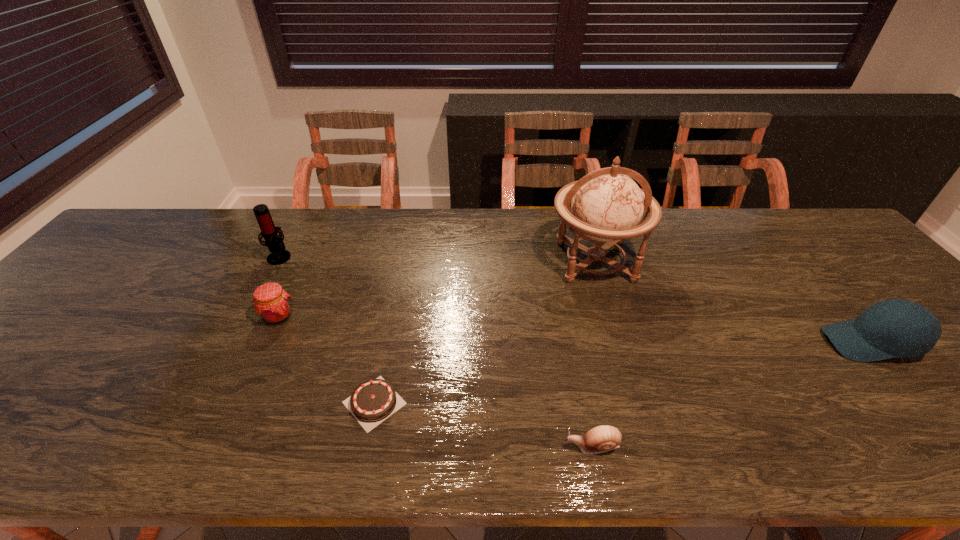
Identify the location of free space that is in between the shortest object and the leftmost object. This screenshot has height=540, width=960. tap(327, 329).

Where is `free spot between the escargot and the third object from left to right`? This screenshot has width=960, height=540. free spot between the escargot and the third object from left to right is located at coordinates (484, 424).

Identify the location of vacant area that lies between the second shortest object and the chocolate cake. This screenshot has height=540, width=960. coord(484,424).

Locate an element on the screen. The height and width of the screenshot is (540, 960). free space between the microphone and the fifth tallest object is located at coordinates (436, 351).

At what (x,y) coordinates should I click in order to perform the action: click on free space that is in between the rightmost object and the microphone. Please return your answer as a coordinate pair (x, y). The height and width of the screenshot is (540, 960). Looking at the image, I should click on (574, 299).

This screenshot has width=960, height=540. I want to click on empty space that is in between the fourth object from right to left and the microphone, so click(x=327, y=329).

Where is `free space between the chocolate cake and the fifth tallest object`? The image size is (960, 540). free space between the chocolate cake and the fifth tallest object is located at coordinates (484, 424).

This screenshot has height=540, width=960. In order to click on blank region between the baseball cap and the second tallest object in this screenshot , I will do `click(574, 299)`.

Locate an element on the screen. Image resolution: width=960 pixels, height=540 pixels. unoccupied area between the second nearest object and the second shortest object is located at coordinates (484, 424).

Find the location of a particular element. The width and height of the screenshot is (960, 540). free spot between the microphone and the shortest object is located at coordinates (327, 329).